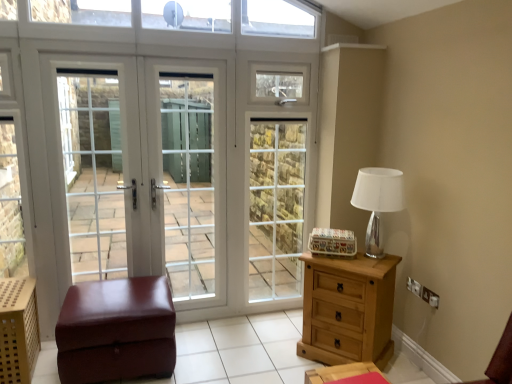
Where is `vacant area situated to the left side of light brown wooden chest of drawers at right`? vacant area situated to the left side of light brown wooden chest of drawers at right is located at coordinates (278, 353).